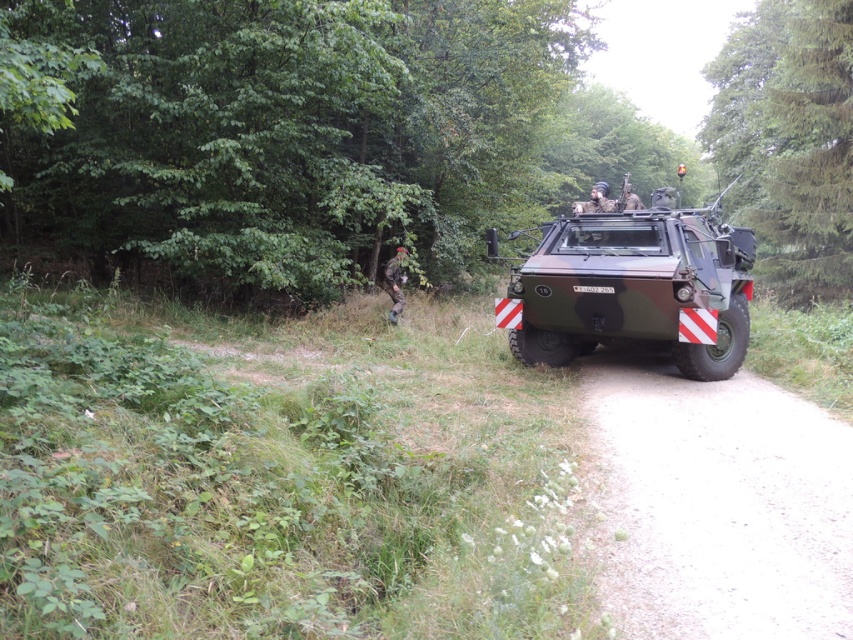
You are a soldier on a mission and see the dirt road at center and the camouflage fabric uniform at center. Which object is closer to you as you face the image?

The dirt road at center is closer to you because it is in front of the camouflage fabric uniform at center.

You are a military officer inspecting the scene. You see the green matte vehicle at center and the camouflage fabric uniform at center. Which object is larger in size?

The green matte vehicle at center is bigger than the camouflage fabric uniform at center.